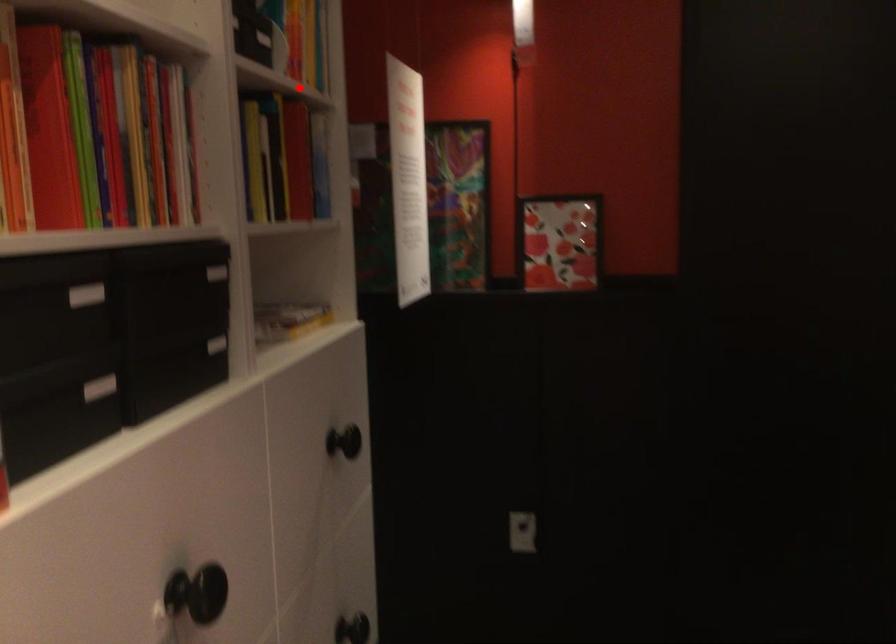
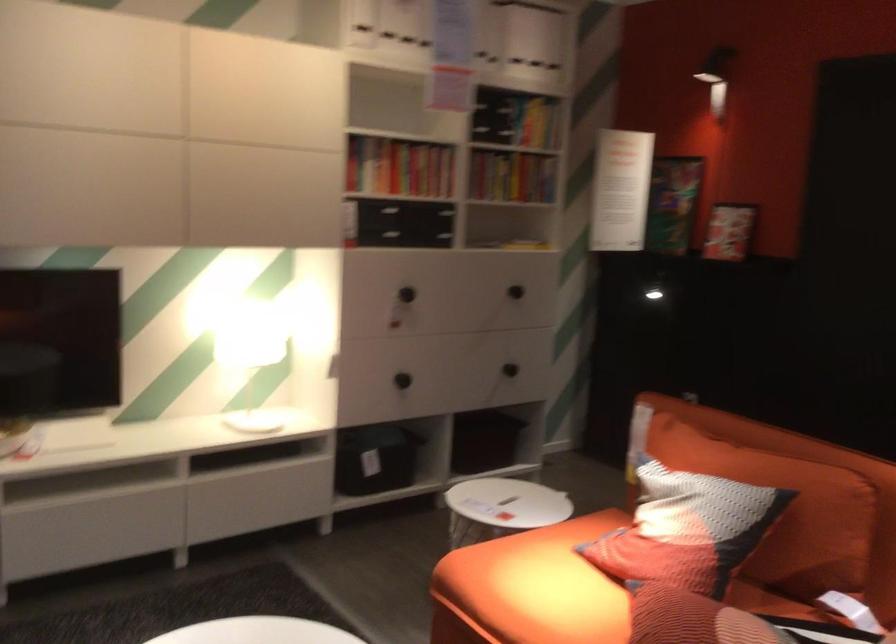
Question: I am providing you with two images of the same scene from different viewpoints. A red point is shown in image1. For the corresponding object point in image2, is it positioned nearer or farther from the camera?

Choices:
 (A) Nearer
 (B) Farther

Answer: (B)